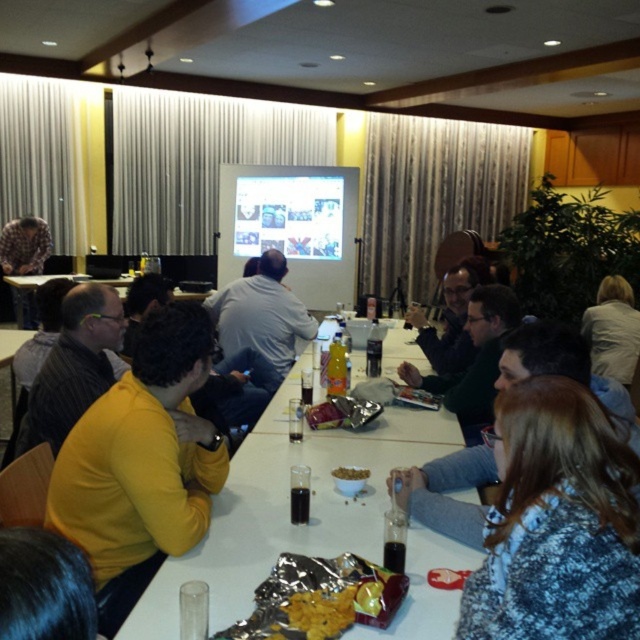
Question: Considering the real-world distances, which object is closest to the matte black shirt at left?

Choices:
 (A) matte plastic projector screen at center
 (B) yellow matte sweater at left

Answer: (B)

Question: Which of these objects is positioned farthest from the matte black shirt at left?

Choices:
 (A) white fabric shirt at upper right
 (B) white glossy table at center
 (C) yellow matte sweater at left
 (D) white plastic table at center

Answer: (A)

Question: Which of the following is the farthest from the observer?

Choices:
 (A) light gray shirt at center
 (B) yellow crispy chips at center
 (C) white glossy table at center

Answer: (A)

Question: Can you confirm if yellow crispy chips at center is wider than brown matte bowl at center?

Choices:
 (A) yes
 (B) no

Answer: (A)

Question: Can you confirm if matte plastic projector screen at center is thinner than brown matte bowl at center?

Choices:
 (A) no
 (B) yes

Answer: (A)

Question: Is yellow matte sweater at left positioned before white fabric shirt at upper right?

Choices:
 (A) yes
 (B) no

Answer: (A)